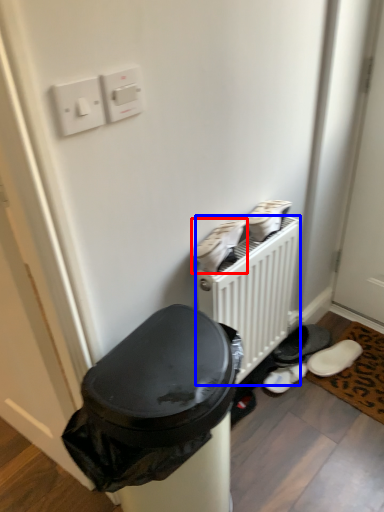
Question: Among these objects, which one is farthest to the camera, footwear (highlighted by a red box) or radiator (highlighted by a blue box)?

Choices:
 (A) footwear
 (B) radiator

Answer: (B)